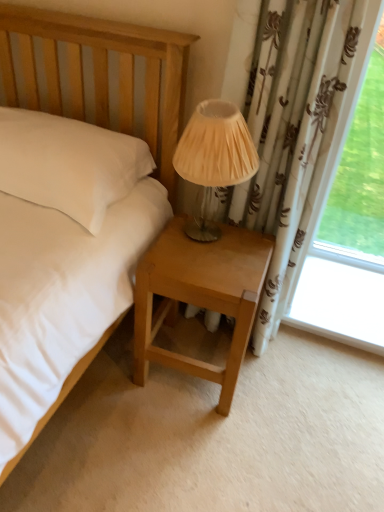
Question: Should I look upward or downward to see light brown wood nightstand at lower center?

Choices:
 (A) down
 (B) up

Answer: (A)

Question: Is light brown wood nightstand at lower center at the right side of matte beige fabric lampshade at center?

Choices:
 (A) yes
 (B) no

Answer: (B)

Question: From a real-world perspective, is light brown wood nightstand at lower center located beneath matte beige fabric lampshade at center?

Choices:
 (A) no
 (B) yes

Answer: (B)

Question: Can you confirm if light brown wood nightstand at lower center is shorter than matte beige fabric lampshade at center?

Choices:
 (A) no
 (B) yes

Answer: (A)

Question: Is light brown wood nightstand at lower center smaller than matte beige fabric lampshade at center?

Choices:
 (A) no
 (B) yes

Answer: (A)

Question: Is light brown wood nightstand at lower center at the left side of matte beige fabric lampshade at center?

Choices:
 (A) no
 (B) yes

Answer: (B)

Question: Is the position of light brown wood nightstand at lower center more distant than that of matte beige fabric lampshade at center?

Choices:
 (A) yes
 (B) no

Answer: (A)

Question: Does matte beige fabric lampshade at center turn towards light brown wood nightstand at lower center?

Choices:
 (A) yes
 (B) no

Answer: (B)

Question: Is matte beige fabric lampshade at center thinner than light brown wood nightstand at lower center?

Choices:
 (A) yes
 (B) no

Answer: (A)

Question: Does matte beige fabric lampshade at center come in front of light brown wood nightstand at lower center?

Choices:
 (A) no
 (B) yes

Answer: (B)

Question: Is matte beige fabric lampshade at center bigger than light brown wood nightstand at lower center?

Choices:
 (A) no
 (B) yes

Answer: (A)

Question: Does matte beige fabric lampshade at center have a lesser height compared to light brown wood nightstand at lower center?

Choices:
 (A) yes
 (B) no

Answer: (A)

Question: Is matte beige fabric lampshade at center at the right side of light brown wood nightstand at lower center?

Choices:
 (A) yes
 (B) no

Answer: (A)

Question: Does point pyautogui.click(x=233, y=315) appear closer or farther from the camera than point pyautogui.click(x=211, y=155)?

Choices:
 (A) farther
 (B) closer

Answer: (A)